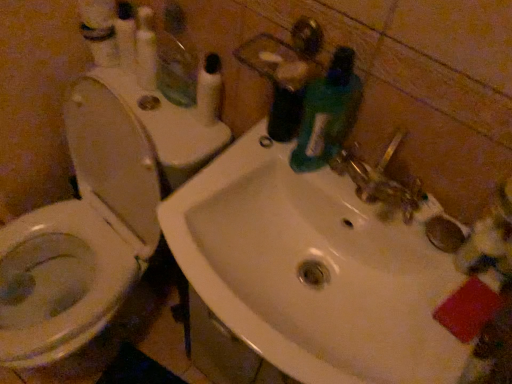
Question: From the image's perspective, would you say white glossy sink at center is shown under clear glass mirror at upper left?

Choices:
 (A) no
 (B) yes

Answer: (B)

Question: From a real-world perspective, is white glossy sink at center over clear glass mirror at upper left?

Choices:
 (A) no
 (B) yes

Answer: (A)

Question: From the image's perspective, is white glossy sink at center above clear glass mirror at upper left?

Choices:
 (A) no
 (B) yes

Answer: (A)

Question: Is white glossy sink at center taller than clear glass mirror at upper left?

Choices:
 (A) yes
 (B) no

Answer: (B)

Question: From a real-world perspective, is white glossy sink at center located beneath clear glass mirror at upper left?

Choices:
 (A) no
 (B) yes

Answer: (B)

Question: Is white glossy sink at center looking in the opposite direction of clear glass mirror at upper left?

Choices:
 (A) yes
 (B) no

Answer: (B)

Question: Is green rubber gloves at sink thinner than clear glass mirror at upper left?

Choices:
 (A) no
 (B) yes

Answer: (A)

Question: From the image's perspective, is green rubber gloves at sink over clear glass mirror at upper left?

Choices:
 (A) yes
 (B) no

Answer: (B)

Question: From the image's perspective, is green rubber gloves at sink beneath clear glass mirror at upper left?

Choices:
 (A) no
 (B) yes

Answer: (B)

Question: Is green rubber gloves at sink not within clear glass mirror at upper left?

Choices:
 (A) yes
 (B) no

Answer: (A)

Question: Does green rubber gloves at sink have a smaller size compared to clear glass mirror at upper left?

Choices:
 (A) no
 (B) yes

Answer: (A)

Question: From a real-world perspective, is green rubber gloves at sink positioned over clear glass mirror at upper left based on gravity?

Choices:
 (A) no
 (B) yes

Answer: (B)

Question: From the image's perspective, is white glossy toilet at left over white plastic pump at upper center?

Choices:
 (A) yes
 (B) no

Answer: (B)